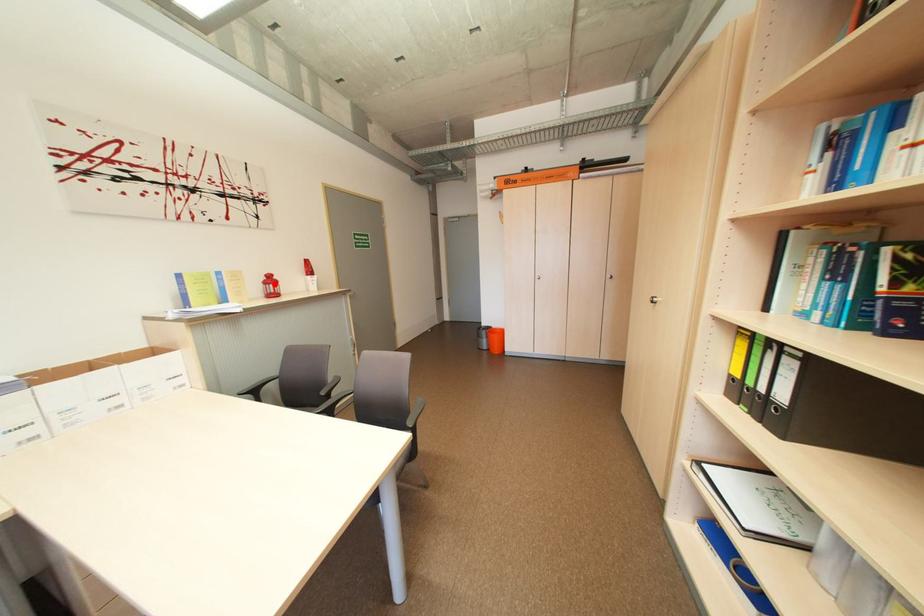
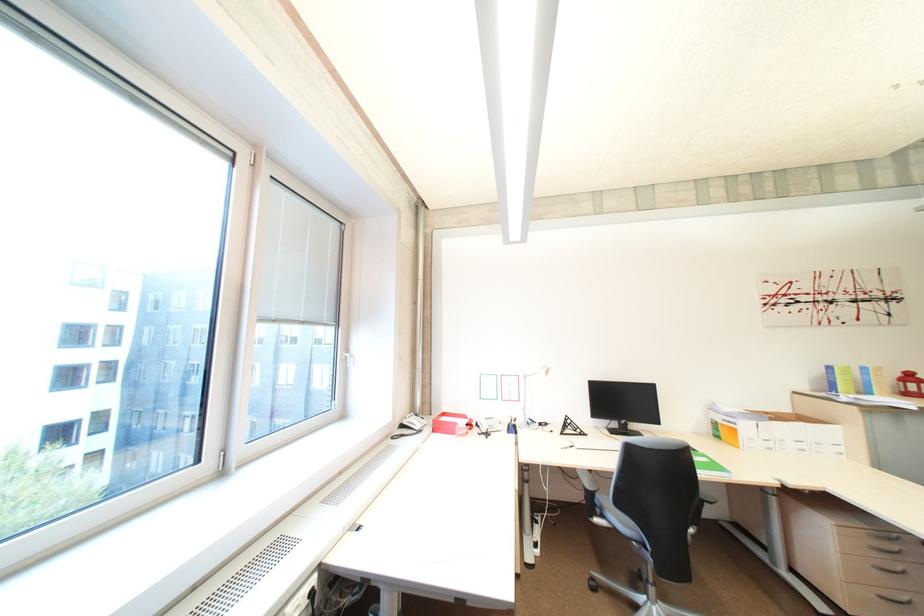
Question: I am providing you with two images of the same scene from different viewpoints. A red point is shown in image1. For the corresponding object point in image2, is it positioned nearer or farther from the camera?

Choices:
 (A) Nearer
 (B) Farther

Answer: (A)